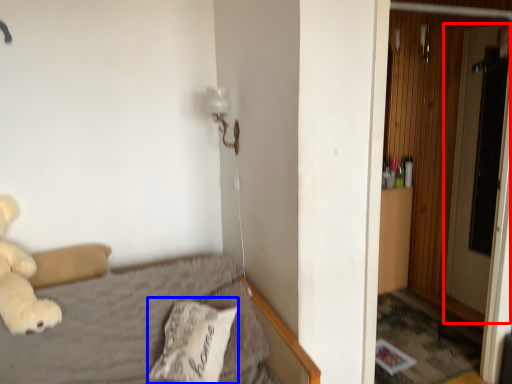
Question: Among these objects, which one is nearest to the camera, screen door (highlighted by a red box) or pillow (highlighted by a blue box)?

Choices:
 (A) screen door
 (B) pillow

Answer: (B)